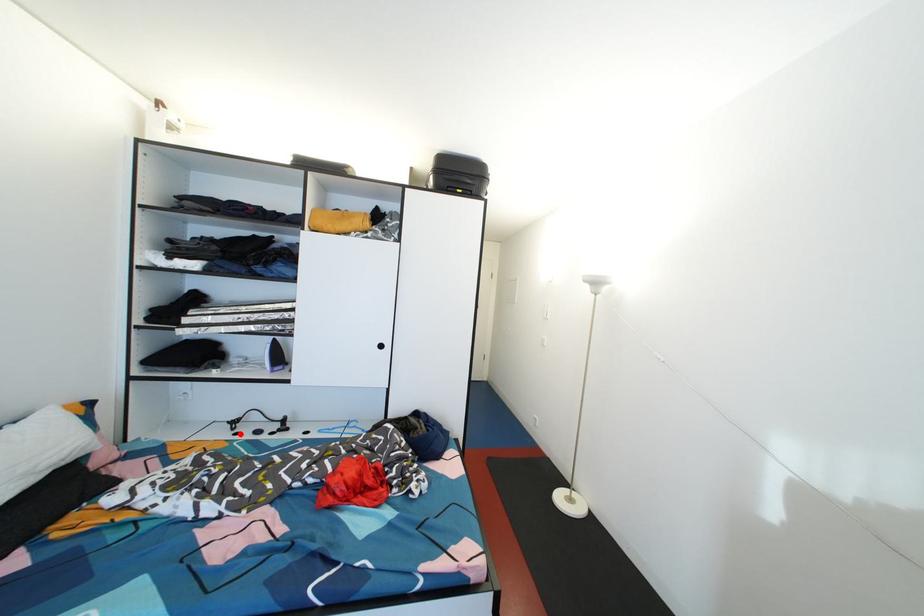
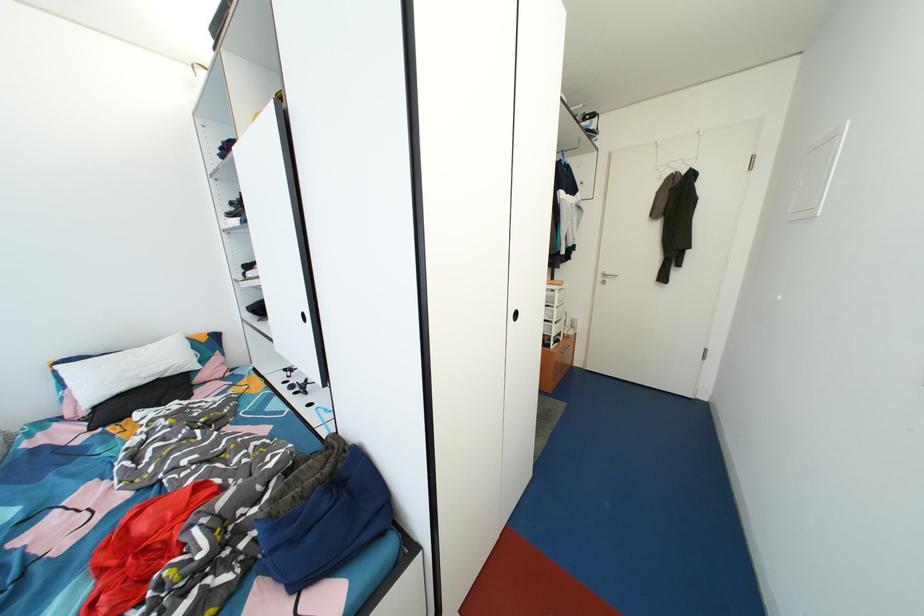
In the second image, find the point that corresponds to the highlighted location in the first image.

(295, 382)